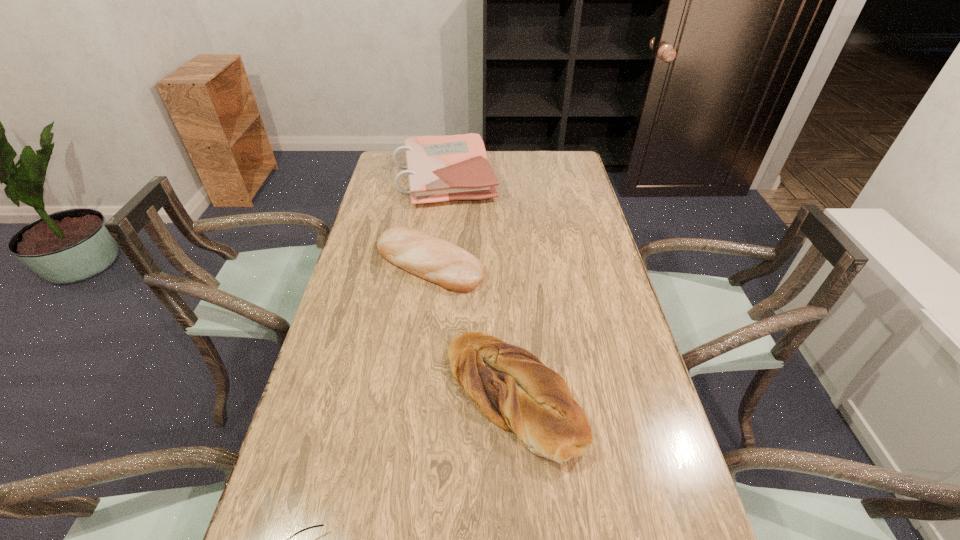
Where is `the tallest object`? the tallest object is located at coordinates (440, 168).

Locate an element on the screen. Image resolution: width=960 pixels, height=540 pixels. the farthest object is located at coordinates (440, 168).

Find the location of a particular element. the second farthest object is located at coordinates (436, 260).

Find the location of a particular element. the nearer bread is located at coordinates (511, 387).

Identify the location of vacant position located on the front of the phonebook. (441, 218).

Identify the location of free space located on the back of the third nearest object. (435, 218).

What are the coordinates of `vacant space positioned 0.060m on the front of the nearer bread` in the screenshot? It's located at (519, 501).

The width and height of the screenshot is (960, 540). I want to click on object that is at the far edge, so click(x=440, y=168).

At what (x,y) coordinates should I click in order to perform the action: click on phonebook that is at the left edge. Please return your answer as a coordinate pair (x, y). Looking at the image, I should click on (440, 168).

Find the location of `bread that is positioned at the left edge`. bread that is positioned at the left edge is located at coordinates (436, 260).